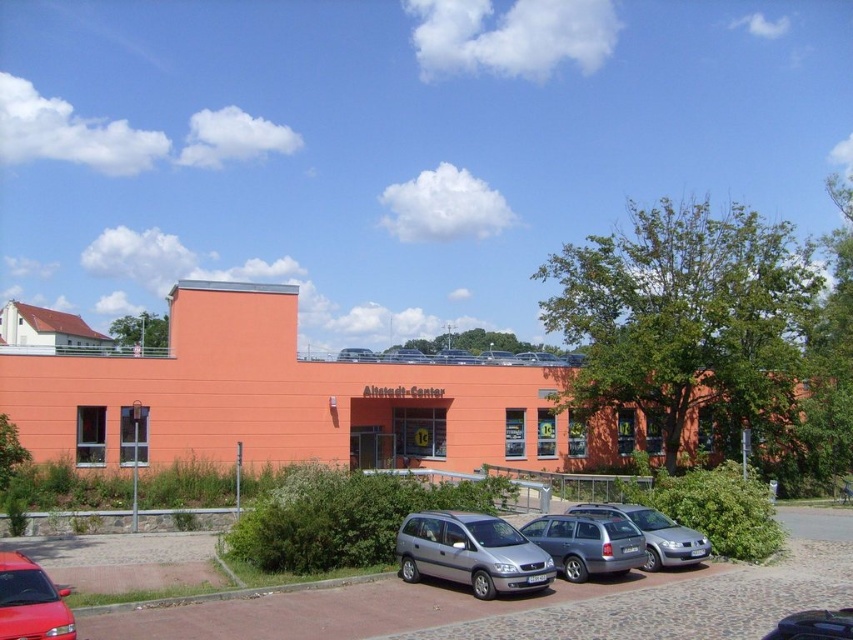
Looking at this image, you are a delivery person trying to park your truck in the parking lot in front of the Altstadt Center. You see a satin silver minivan at center and a silver metallic hatchback at lower right. Which vehicle should you move to access the parking spot behind them?

The satin silver minivan at center is in front of the silver metallic hatchback at lower right, so you should move the satin silver minivan at center first to access the parking spot behind them.

You are a delivery driver who needs to access the entrance of the Altstadt Center. You see the satin silver minivan at center and the silver metallic station wagon at center blocking the path. Which vehicle should you move first to clear the path?

The satin silver minivan at center is in front of the silver metallic station wagon at center, so you should move the satin silver minivan at center first to allow access to the entrance.

You are a delivery person who needs to park your 5 meter long truck between the silver metallic station wagon at center and the shiny red car at lower left. Is there enough space between them for your truck?

The distance between the silver metallic station wagon at center and the shiny red car at lower left is 9.91 meters. Since your truck is 5 meters long, there is sufficient space between them to park your truck.